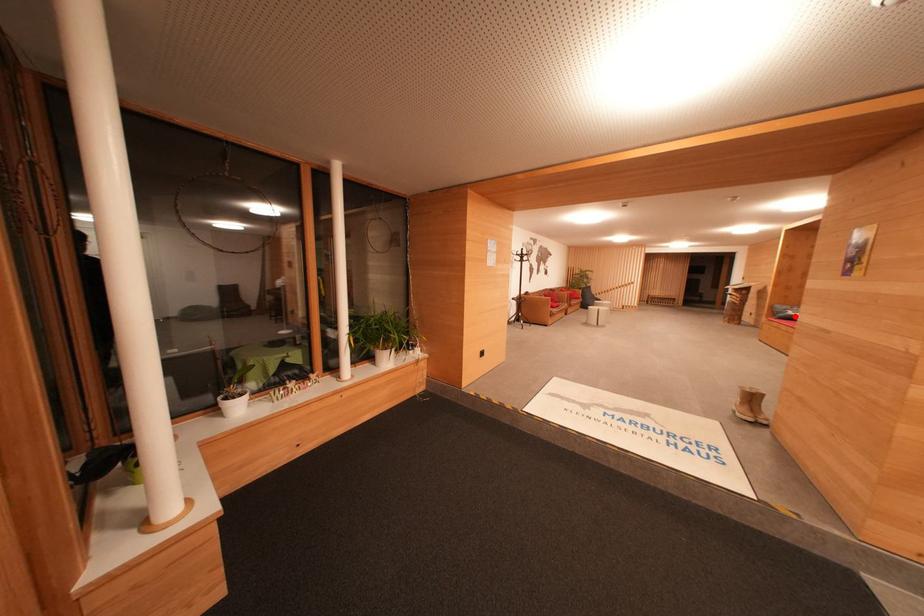
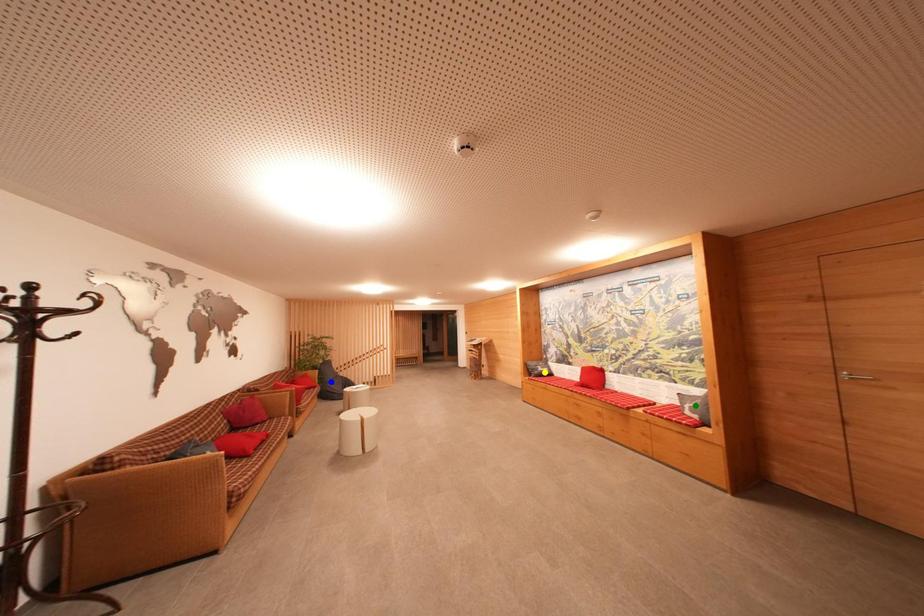
Question: I am providing you with two images of the same scene from different viewpoints. A red point is marked on the first image. You are given multiple points on the second image. Which point in image 2 represents the same 3d spot as the red point in image 1?

Choices:
 (A) blue point
 (B) green point
 (C) yellow point

Answer: (C)